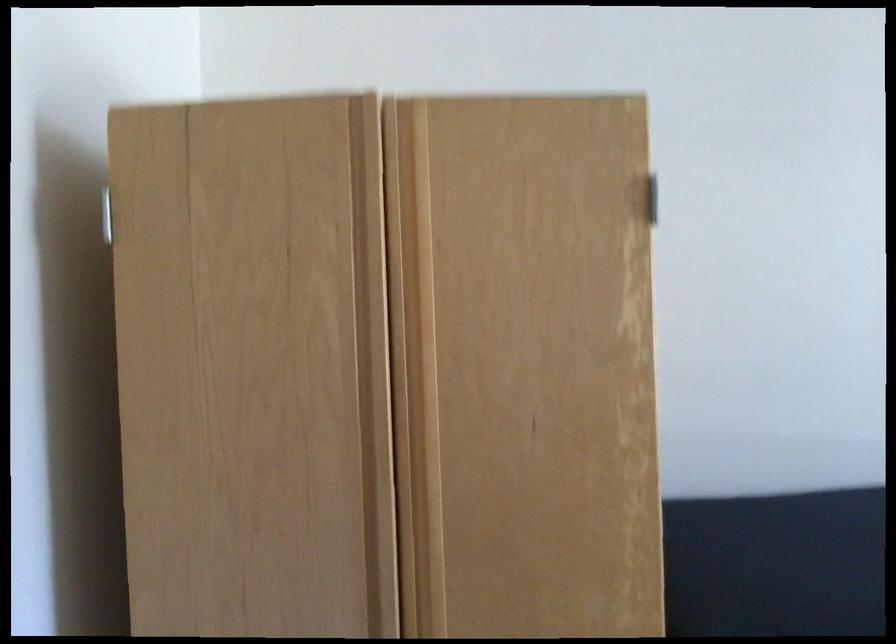
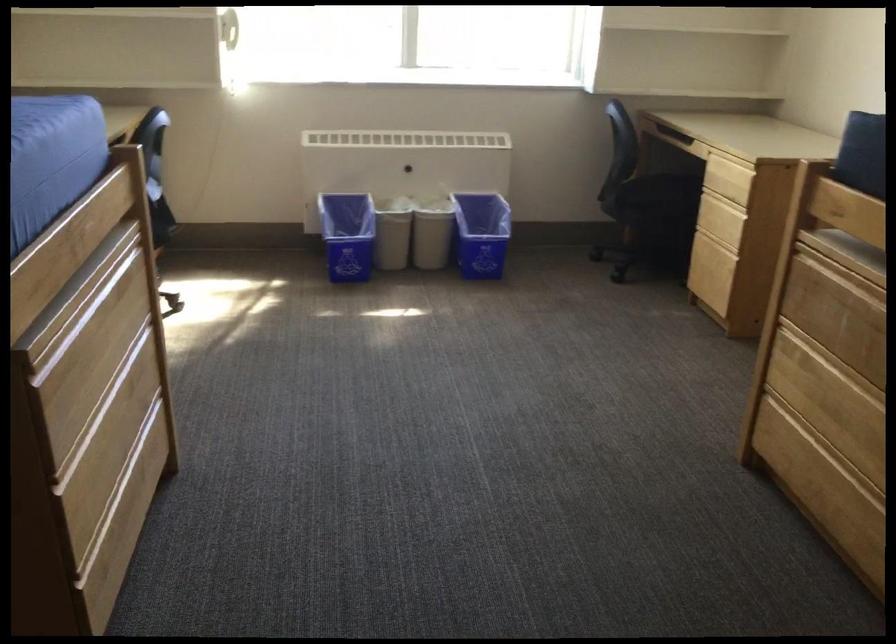
The images are taken continuously from a first-person perspective. In which direction is your viewpoint rotating?

The camera's rotation is toward right-down.